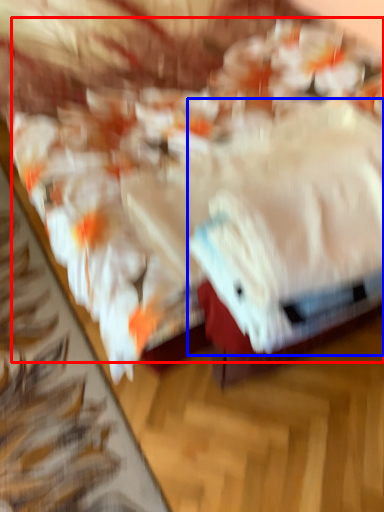
Question: Which point is closer to the camera, food (highlighted by a red box) or towel (highlighted by a blue box)?

Choices:
 (A) food
 (B) towel

Answer: (A)